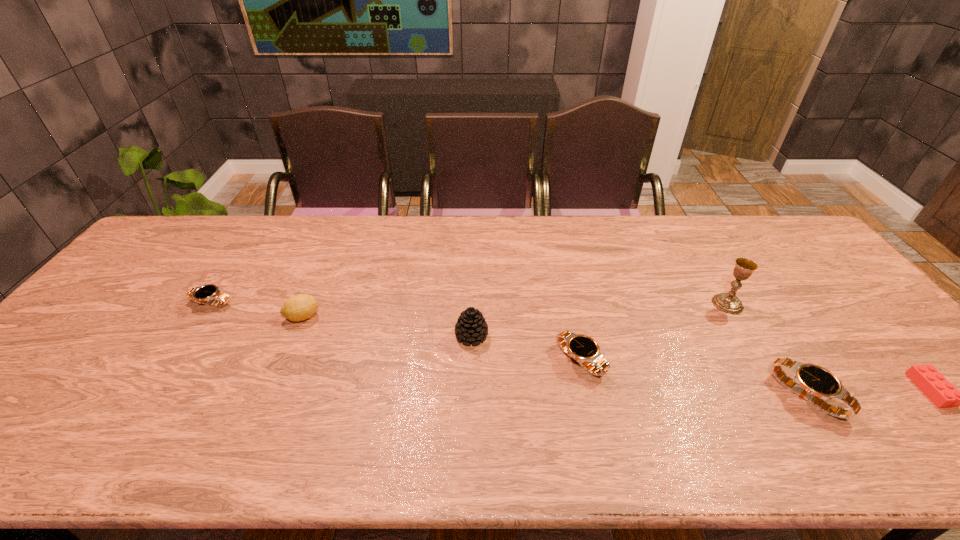
If equal spacing is desired by inserting an extra watch among them, please point out a free spot for this new watch. Please provide its 2D coordinates. Your answer should be formatted as a tuple, i.e. [(x, y)], where the tuple contains the x and y coordinates of a point satisfying the conditions above.

[(384, 329)]